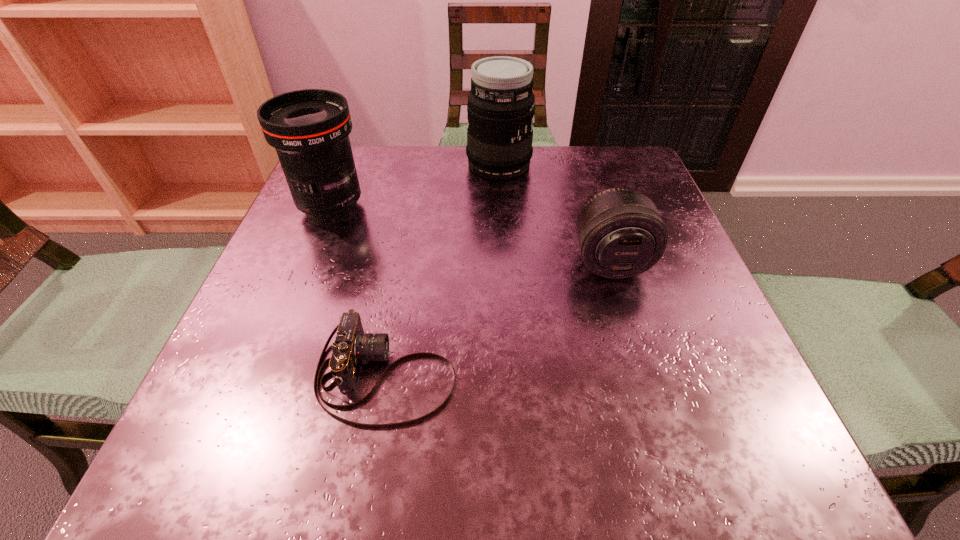
In order to click on free space located 0.310m on the front-facing side of the rightmost object in this screenshot , I will do `click(675, 472)`.

Where is `blank area located 0.220m on the front-facing side of the shortest object`? The image size is (960, 540). blank area located 0.220m on the front-facing side of the shortest object is located at coordinates (612, 374).

This screenshot has width=960, height=540. In order to click on object that is positioned at the near edge in this screenshot , I will do `click(352, 346)`.

This screenshot has width=960, height=540. I want to click on telephoto lens present at the left edge, so click(309, 128).

At what (x,y) coordinates should I click in order to perform the action: click on camera that is at the left edge. Please return your answer as a coordinate pair (x, y). This screenshot has height=540, width=960. Looking at the image, I should click on (352, 346).

Identify the location of object that is at the right edge. (620, 234).

Where is `object that is at the far left corner`? Image resolution: width=960 pixels, height=540 pixels. object that is at the far left corner is located at coordinates (309, 128).

Image resolution: width=960 pixels, height=540 pixels. I want to click on object at the near left corner, so click(x=352, y=346).

The width and height of the screenshot is (960, 540). In the image, there is a desktop. Find the location of `vacant space at the far edge`. vacant space at the far edge is located at coordinates (441, 157).

In the image, there is a desktop. Where is `vacant space at the near edge`? The width and height of the screenshot is (960, 540). vacant space at the near edge is located at coordinates (446, 475).